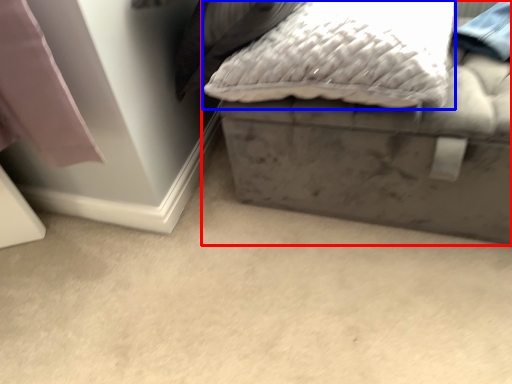
Question: Which of the following is the farthest to the observer, furniture (highlighted by a red box) or pillow (highlighted by a blue box)?

Choices:
 (A) furniture
 (B) pillow

Answer: (A)